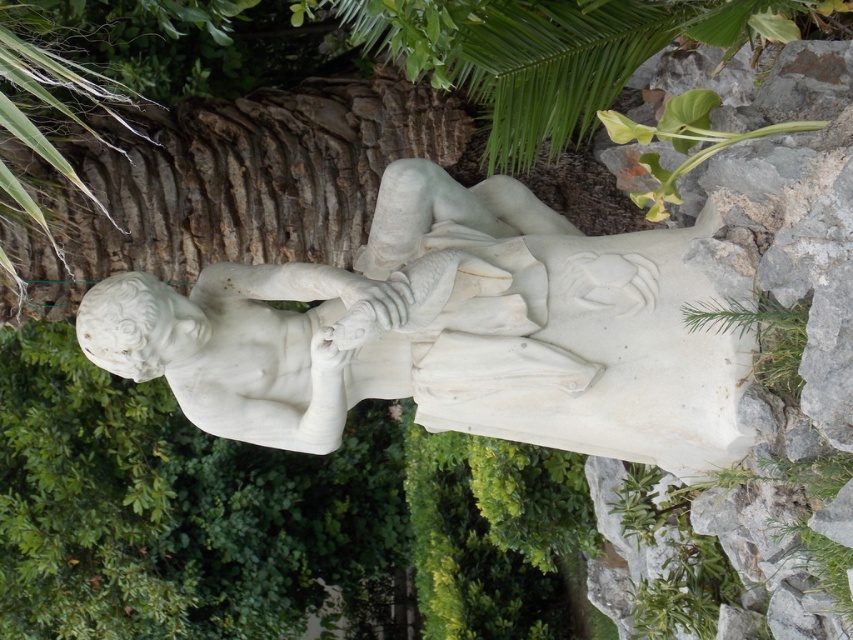
Question: Can you confirm if white marble statue at center is smaller than green leafy plant at lower right?

Choices:
 (A) yes
 (B) no

Answer: (B)

Question: Can you confirm if white marble statue at center is wider than green leafy plant at lower right?

Choices:
 (A) no
 (B) yes

Answer: (B)

Question: Among these objects, which one is farthest from the camera?

Choices:
 (A) green leafy plant at lower right
 (B) white marble statue at center

Answer: (B)

Question: Which of the following is the farthest from the observer?

Choices:
 (A) (141, 356)
 (B) (805, 314)

Answer: (A)

Question: Does white marble statue at center have a larger size compared to green leafy plant at lower right?

Choices:
 (A) yes
 (B) no

Answer: (A)